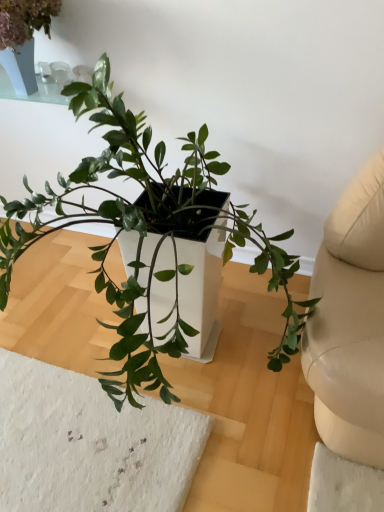
Question: From the image's perspective, is green matte plant at center, the 2th houseplant viewed from the left, positioned above or below green matte plant at upper left, the 2th houseplant viewed from the right?

Choices:
 (A) below
 (B) above

Answer: (A)

Question: In terms of size, does green matte plant at center, the 2th houseplant viewed from the left, appear bigger or smaller than green matte plant at upper left, the 2th houseplant viewed from the right?

Choices:
 (A) big
 (B) small

Answer: (A)

Question: Choose the correct answer: Is green matte plant at center, the 2th houseplant viewed from the left, inside green matte plant at upper left, the 2th houseplant viewed from the right, or outside it?

Choices:
 (A) inside
 (B) outside

Answer: (B)

Question: In the image, is green matte plant at upper left, the 1th houseplant from the left, positioned in front of or behind green matte plant at center, the 1th houseplant in the right-to-left sequence?

Choices:
 (A) front
 (B) behind

Answer: (B)

Question: Is green matte plant at upper left, the 2th houseplant viewed from the right, inside the boundaries of green matte plant at center, the 1th houseplant in the right-to-left sequence, or outside?

Choices:
 (A) outside
 (B) inside

Answer: (A)

Question: Does point 34,14 appear closer or farther from the camera than point 112,130?

Choices:
 (A) farther
 (B) closer

Answer: (A)

Question: In terms of size, does green matte plant at upper left, the 2th houseplant viewed from the right, appear bigger or smaller than green matte plant at center, the 1th houseplant in the right-to-left sequence?

Choices:
 (A) big
 (B) small

Answer: (B)